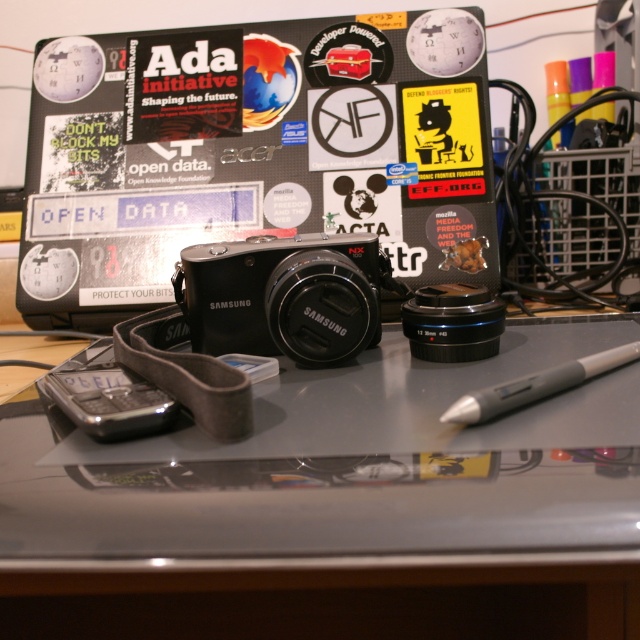
You need to place a 10 cm long USB drive on the desk. Given the metallic gray mousepad at center and the gray matte pen at lower right, which object can accommodate the USB drive without overlapping other items?

The metallic gray mousepad at center is larger in size than the gray matte pen at lower right, so the USB drive can be placed on the metallic gray mousepad at center without overlapping other items.

You are organizing a photography workshop and need to place a ruler on the desk such that it is exactly 10 inches away from the Samsung NX100 camera. Given the coordinates provided, can the point at point [452,561] be used to position the ruler?

The point at point [452,561] is exactly 9.89 inches away from the Samsung NX100 camera, which is just under 10 inches. Depending on the required precision, this point may be close enough for the ruler placement.

You are organizing the desk items and need to place the metallic gray mousepad at center. Where exactly should you position it on the desk according to the coordinates provided?

The metallic gray mousepad at center should be positioned at coordinates point [317,544] as specified.